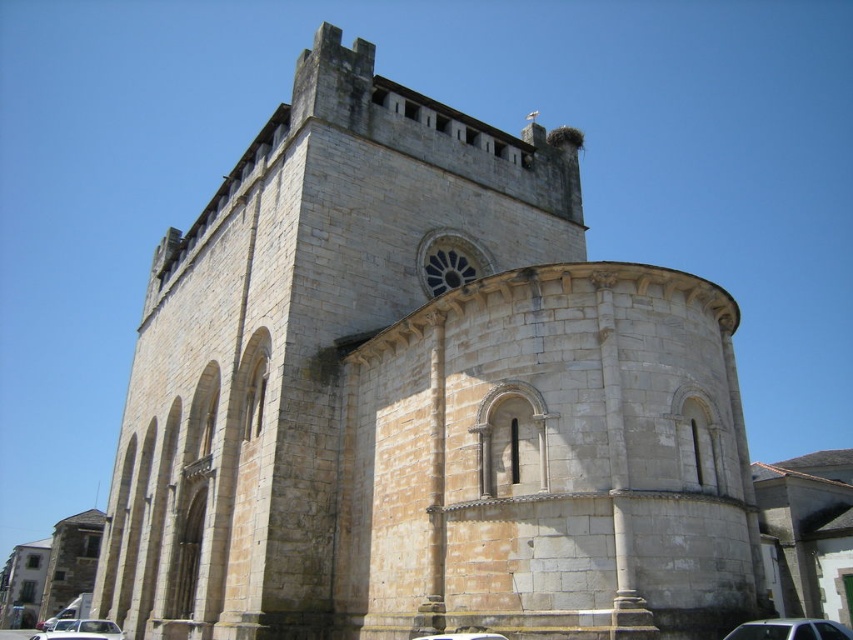
Question: Estimate the real-world distances between objects in this image. Which object is farther from the white matte car at lower left?

Choices:
 (A) metallic silver car at lower right
 (B) white matte car at lower center

Answer: (A)

Question: Which point appears closest to the camera in this image?

Choices:
 (A) (85, 624)
 (B) (474, 632)
 (C) (767, 627)

Answer: (C)

Question: From the image, what is the correct spatial relationship of metallic silver car at lower right in relation to white matte car at lower center?

Choices:
 (A) above
 (B) below

Answer: (B)

Question: Considering the relative positions of metallic silver car at lower right and white matte car at lower left in the image provided, where is metallic silver car at lower right located with respect to white matte car at lower left?

Choices:
 (A) right
 (B) left

Answer: (A)

Question: Estimate the real-world distances between objects in this image. Which object is farther from the metallic silver car at lower right?

Choices:
 (A) white matte car at lower left
 (B) white matte car at lower center

Answer: (A)

Question: Can you confirm if white matte car at lower left is positioned above white matte car at lower center?

Choices:
 (A) no
 (B) yes

Answer: (A)